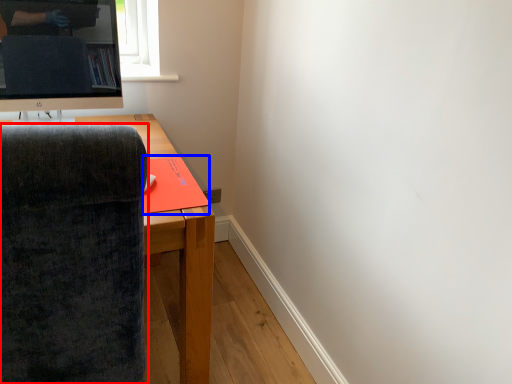
Question: Which point is closer to the camera, chair (highlighted by a red box) or book (highlighted by a blue box)?

Choices:
 (A) chair
 (B) book

Answer: (A)